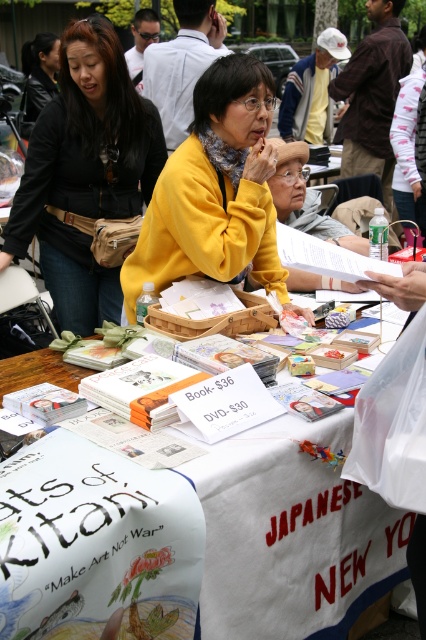
Question: Which object appears farthest from the camera in this image?

Choices:
 (A) matte yellow sweater at center
 (B) matte black jacket at upper left
 (C) white fabric at center

Answer: (B)

Question: Is white fabric at center thinner than matte black jacket at upper left?

Choices:
 (A) no
 (B) yes

Answer: (B)

Question: Which point is farther to the camera?

Choices:
 (A) white fabric at center
 (B) matte yellow sweater at center

Answer: (B)

Question: Which object is positioned closest to the white fabric at center?

Choices:
 (A) matte yellow sweater at center
 (B) matte black jacket at upper left

Answer: (A)

Question: Can you confirm if white fabric at center is positioned above matte black jacket at upper left?

Choices:
 (A) no
 (B) yes

Answer: (A)

Question: Can you confirm if matte black jacket at upper left is positioned to the left of matte yellow sweater at center?

Choices:
 (A) no
 (B) yes

Answer: (B)